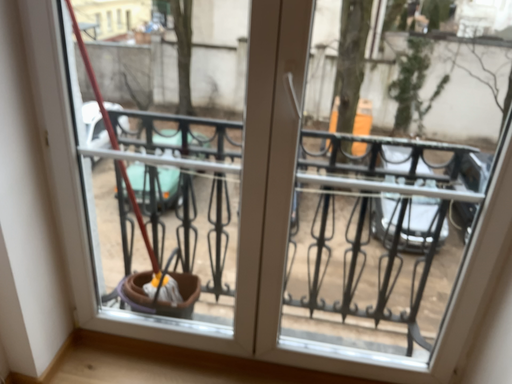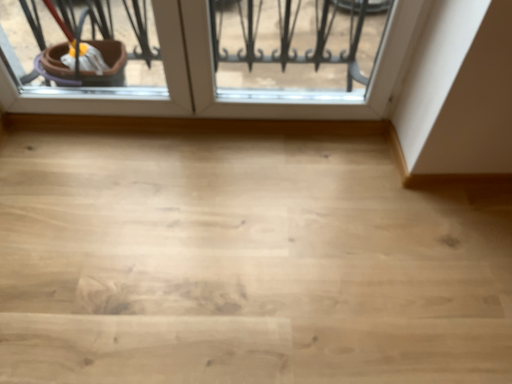
Question: How did the camera likely rotate when shooting the video?

Choices:
 (A) rotated right
 (B) rotated left

Answer: (A)